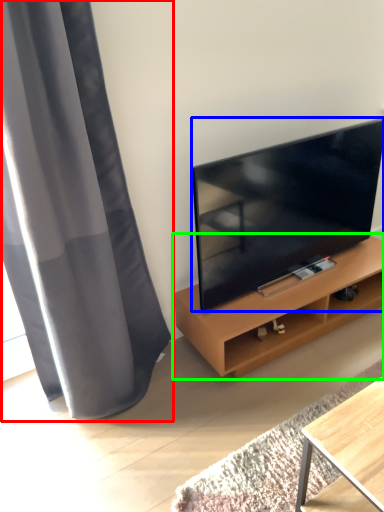
Question: Which object is positioned closest to curtain (highlighted by a red box)? Select from television (highlighted by a blue box) and shelf (highlighted by a green box).

Choices:
 (A) television
 (B) shelf

Answer: (A)